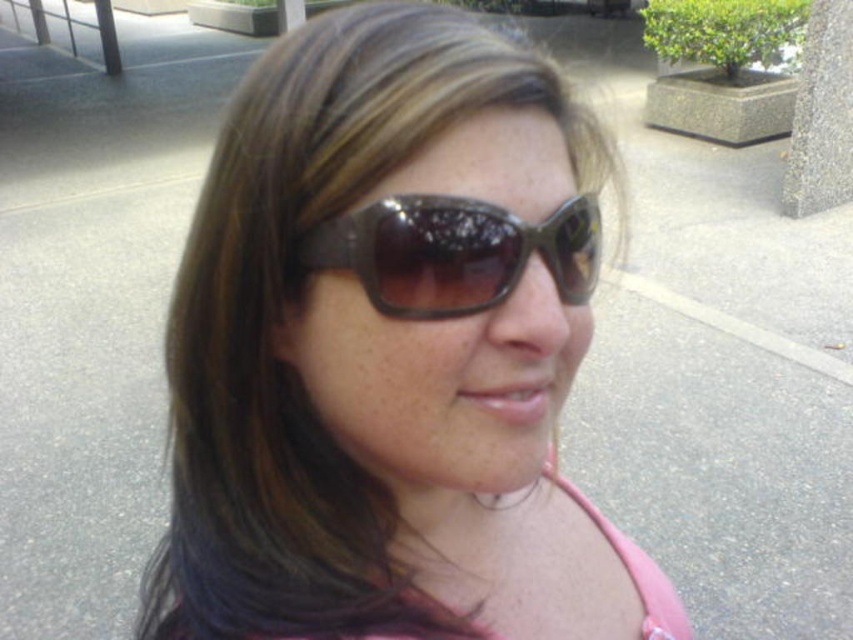
You are a photographer trying to capture a close detail of the person wearing both matte brown sunglasses at center and shiny brown sunglasses at center. Since you can only focus on one pair at a time, which pair should you choose to ensure the larger one is in focus?

The matte brown sunglasses at center is bigger than the shiny brown sunglasses at center, so you should focus on the matte brown sunglasses at center to ensure the larger one is in focus.

You are a photographer standing at the camera position. You want to take a photo of the person while ensuring that the point at coordinates point (329,232) is included in the frame. Given that the camera has a focal length of 50mm and the subject is 13.52 inches away from the camera, will the point be within the camera frame?

The point at coordinates point (329,232) is 13.52 inches away from the camera. Since the camera is positioned to capture the person and the point is within the subject area, the point should be within the camera frame.